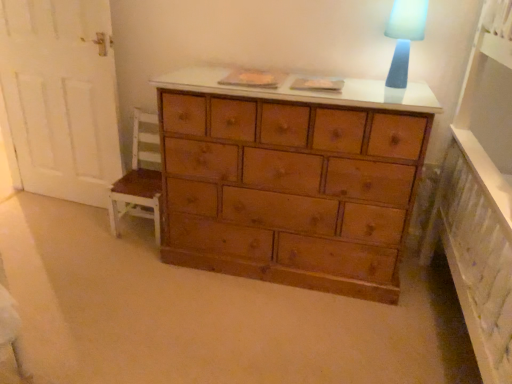
Where is `vacant space underneath white painted wood chair at left (from a real-world perspective)`? The image size is (512, 384). vacant space underneath white painted wood chair at left (from a real-world perspective) is located at coordinates (139, 229).